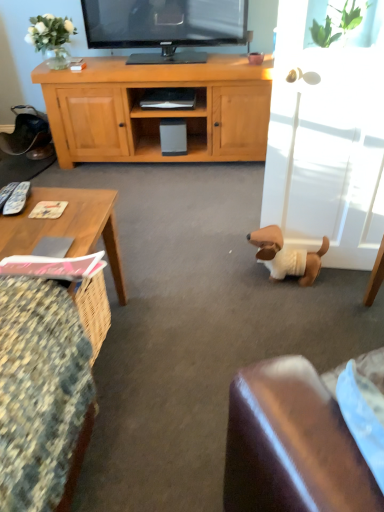
The height and width of the screenshot is (512, 384). What do you see at coordinates (40, 392) in the screenshot? I see `floral fabric cushion at lower left` at bounding box center [40, 392].

At what (x,y) coordinates should I click in order to perform the action: click on floral fabric cushion at lower left. Please return your answer as a coordinate pair (x, y). The image size is (384, 512). Looking at the image, I should click on (40, 392).

Image resolution: width=384 pixels, height=512 pixels. Identify the location of wooden textured coffee table at lower left. (68, 227).

Where is `white plush dog at lower right`? This screenshot has width=384, height=512. white plush dog at lower right is located at coordinates (286, 256).

Which object is thinner, white glossy glass door at right or white plush dog at lower right?

white plush dog at lower right.

Does white glossy glass door at right lie in front of white plush dog at lower right?

Yes, white glossy glass door at right is closer to the camera.

From a real-world perspective, which is physically below, white glossy glass door at right or white plush dog at lower right?

white plush dog at lower right, from a real-world perspective.

Is white glossy glass door at right next to white plush dog at lower right and touching it?

No, white glossy glass door at right is not next to white plush dog at lower right.

Is wooden textured coffee table at lower left in front of or behind floral fabric cushion at lower left in the image?

wooden textured coffee table at lower left is behind floral fabric cushion at lower left.

Between wooden textured coffee table at lower left and floral fabric cushion at lower left, which one has larger width?

floral fabric cushion at lower left.

Identify the location of chair located in front of the wooden textured coffee table at lower left. Image resolution: width=384 pixels, height=512 pixels. (40, 392).

Is wooden textured coffee table at lower left shorter than floral fabric cushion at lower left?

Yes, wooden textured coffee table at lower left is shorter than floral fabric cushion at lower left.

The height and width of the screenshot is (512, 384). I want to click on dog lying above the floral fabric cushion at lower left (from the image's perspective), so click(286, 256).

Does floral fabric cushion at lower left have a lesser height compared to white plush dog at lower right?

In fact, floral fabric cushion at lower left may be taller than white plush dog at lower right.

Is floral fabric cushion at lower left looking in the opposite direction of white plush dog at lower right?

That's not correct — floral fabric cushion at lower left is not looking away from white plush dog at lower right.

From a real-world perspective, is floral fabric cushion at lower left under white plush dog at lower right?

Incorrect, from a real-world perspective, floral fabric cushion at lower left is higher than white plush dog at lower right.

Looking at the image, does matte black shelf at center seem bigger or smaller compared to floral fabric cushion at lower left?

Clearly, matte black shelf at center is smaller in size than floral fabric cushion at lower left.

Is floral fabric cushion at lower left a part of matte black shelf at center?

Actually, floral fabric cushion at lower left is outside matte black shelf at center.

From the image's perspective, which is above, matte black shelf at center or floral fabric cushion at lower left?

matte black shelf at center appears higher in the image.

Consider the image. Considering the relative sizes of white plush dog at lower right and wooden textured coffee table at lower left in the image provided, is white plush dog at lower right smaller than wooden textured coffee table at lower left?

No, white plush dog at lower right is not smaller than wooden textured coffee table at lower left.

From the image's perspective, is white plush dog at lower right over wooden textured coffee table at lower left?

Correct, white plush dog at lower right appears higher than wooden textured coffee table at lower left in the image.

Does white plush dog at lower right have a lesser height compared to wooden textured coffee table at lower left?

No.

Based on the photo, in terms of width, does white plush dog at lower right look wider or thinner when compared to wooden textured coffee table at lower left?

In the image, white plush dog at lower right appears to be wider than wooden textured coffee table at lower left.

At what (x,y) coordinates should I click in order to perform the action: click on glass door above the wooden textured coffee table at lower left (from the image's perspective). Please return your answer as a coordinate pair (x, y). The height and width of the screenshot is (512, 384). Looking at the image, I should click on (337, 156).

From the image's perspective, which object appears higher, white glossy glass door at right or wooden textured coffee table at lower left?

white glossy glass door at right.

Is white glossy glass door at right situated inside wooden textured coffee table at lower left or outside?

white glossy glass door at right is located beyond the bounds of wooden textured coffee table at lower left.

Considering the sizes of objects white glossy glass door at right and wooden textured coffee table at lower left in the image provided, who is smaller, white glossy glass door at right or wooden textured coffee table at lower left?

wooden textured coffee table at lower left.

Which of these two, white plush dog at lower right or floral fabric cushion at lower left, stands taller?

Standing taller between the two is floral fabric cushion at lower left.

Is white plush dog at lower right oriented towards floral fabric cushion at lower left?

No, white plush dog at lower right is not oriented towards floral fabric cushion at lower left.

Looking at this image, is white plush dog at lower right next to floral fabric cushion at lower left?

white plush dog at lower right and floral fabric cushion at lower left are not in contact.

The height and width of the screenshot is (512, 384). In order to click on glass door that appears above the white plush dog at lower right (from a real-world perspective) in this screenshot , I will do `click(337, 156)`.

The width and height of the screenshot is (384, 512). In order to click on chair to the left of wooden textured coffee table at lower left in this screenshot , I will do `click(40, 392)`.

Estimate the real-world distances between objects in this image. Which object is closer to white plush dog at lower right, matte black shelf at center or floral fabric cushion at lower left?

floral fabric cushion at lower left lies closer to white plush dog at lower right than the other object.

From the image, which object appears to be nearer to white glossy glass door at right, matte black shelf at center or floral fabric cushion at lower left?

floral fabric cushion at lower left is positioned closer to the anchor white glossy glass door at right.

Looking at the image, which one is located closer to matte black shelf at center, wooden textured coffee table at lower left or white glossy glass door at right?

The object closer to matte black shelf at center is wooden textured coffee table at lower left.

From the image, which object appears to be farther from wooden textured coffee table at lower left, matte black shelf at center or white plush dog at lower right?

Based on the image, matte black shelf at center appears to be further to wooden textured coffee table at lower left.

Which object lies further to the anchor point matte black shelf at center, white glossy glass door at right or wooden textured coffee table at lower left?

white glossy glass door at right is further to matte black shelf at center.

From the image, which object appears to be farther from wooden textured coffee table at lower left, white glossy glass door at right or white plush dog at lower right?

white glossy glass door at right lies further to wooden textured coffee table at lower left than the other object.

Based on their spatial positions, is matte black shelf at center or wooden textured coffee table at lower left further from white plush dog at lower right?

matte black shelf at center is positioned further to the anchor white plush dog at lower right.

Considering their positions, is matte black shelf at center positioned closer to floral fabric cushion at lower left than white plush dog at lower right?

Based on the image, white plush dog at lower right appears to be nearer to floral fabric cushion at lower left.

Find the location of a particular element. This screenshot has height=512, width=384. glass door between floral fabric cushion at lower left and matte black shelf at center from front to back is located at coordinates (337, 156).

At what (x,y) coordinates should I click in order to perform the action: click on coffee table between floral fabric cushion at lower left and matte black shelf at center in the front-back direction. Please return your answer as a coordinate pair (x, y). The image size is (384, 512). Looking at the image, I should click on (68, 227).

Where is `coffee table situated between floral fabric cushion at lower left and white glossy glass door at right from left to right`? coffee table situated between floral fabric cushion at lower left and white glossy glass door at right from left to right is located at coordinates (68, 227).

I want to click on glass door between floral fabric cushion at lower left and white plush dog at lower right along the z-axis, so click(337, 156).